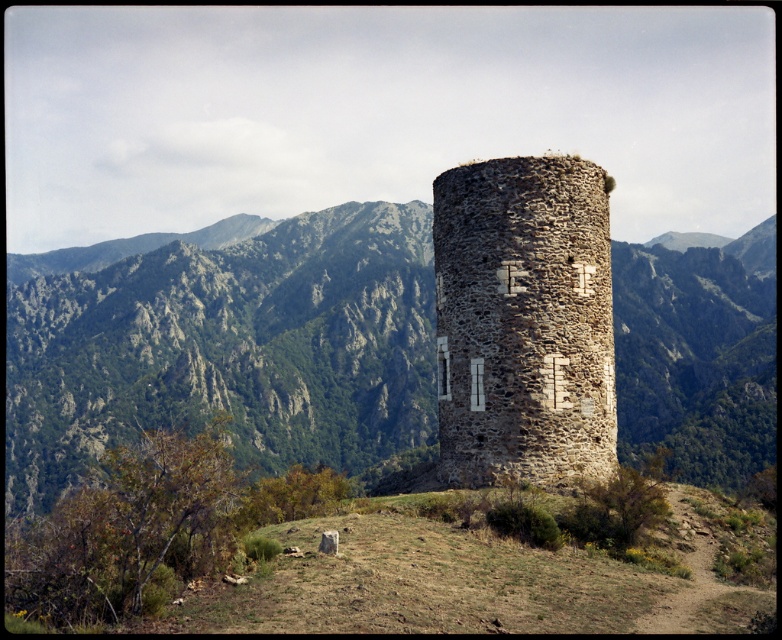
Question: Is the position of rugged stone tower at center more distant than that of rustic stone tower at center?

Choices:
 (A) no
 (B) yes

Answer: (B)

Question: Which point is closer to the camera?

Choices:
 (A) rustic stone tower at center
 (B) rugged stone tower at center

Answer: (A)

Question: Among these objects, which one is nearest to the camera?

Choices:
 (A) rugged stone tower at center
 (B) rustic stone tower at center

Answer: (B)

Question: Does rugged stone tower at center appear under rustic stone tower at center?

Choices:
 (A) yes
 (B) no

Answer: (B)

Question: Does rugged stone tower at center appear over rustic stone tower at center?

Choices:
 (A) no
 (B) yes

Answer: (B)

Question: Which point is closer to the camera?

Choices:
 (A) rugged stone tower at center
 (B) rustic stone tower at center

Answer: (B)